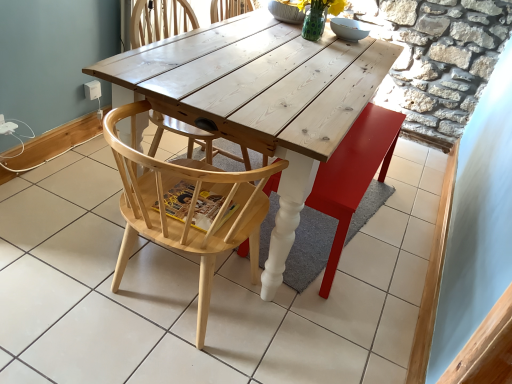
This screenshot has height=384, width=512. What are the coordinates of `vacant area located to the right-hand side of natural wood chair at center, which is counted as the 2th chair, starting from the back` in the screenshot? It's located at (302, 331).